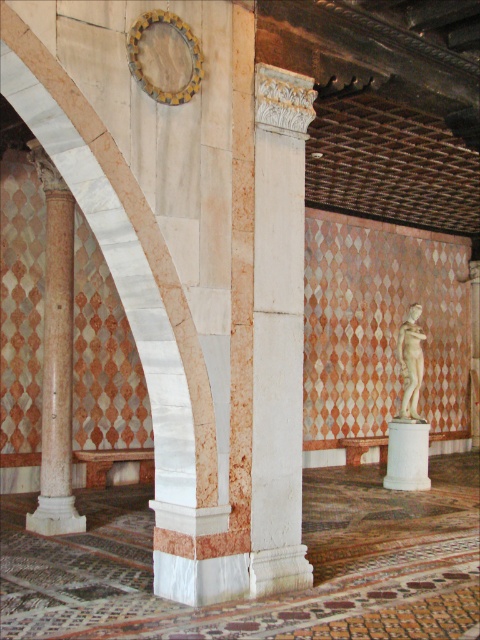
You are standing in a historical building and want to take a photo of the marble column at left. If your camera has a maximum focus range of 30 feet, will you be able to capture the column clearly?

The marble column at left and camera are 30.58 feet apart, which exceeds the camera maximum focus range of 30 feet. Therefore, the camera cannot focus on the marble column at left clearly.

You are an interior designer planning to place a new decorative item in the space between the white marble column at center and the white marble statue at center. Given their sizes, which object should you consider moving closer to the wall to create more space for the new item?

The white marble statue at center should be moved closer to the wall since it is smaller in size than the white marble column at center, allowing more space for the new decorative item.

You are an architect planning to install a new lighting fixture between the white marble column at center and the white marble statue at center. The fixture requires a minimum of 20 feet of space to be safely installed. Based on the scene, is there enough space between them for this installation?

The distance between the white marble column at center and the white marble statue at center is 19.50 feet, which is less than the required 20 feet. Therefore, there isn not enough space for the lighting fixture to be safely installed.